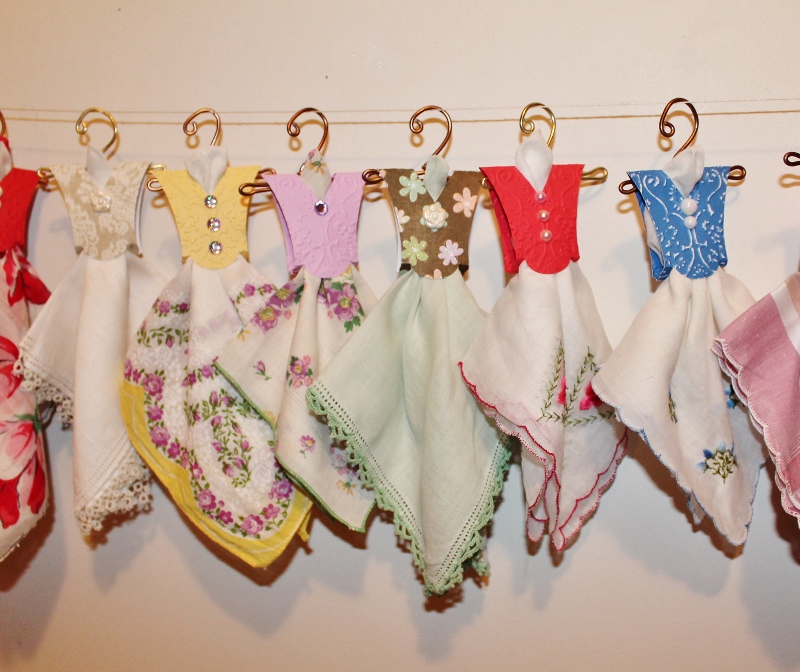
At what (x,y) coordinates should I click in order to perform the action: click on flowers / floral motif. Please return your answer as a coordinate pair (x, y). Looking at the image, I should click on (717, 457), (584, 407), (293, 366), (222, 418), (14, 444), (452, 249).